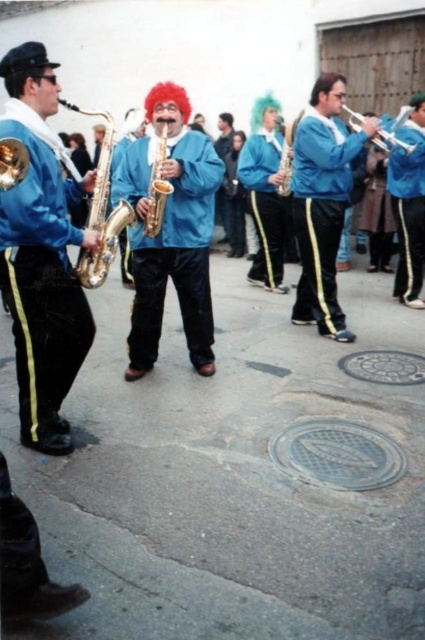
Based on the photo, does matte blue jacket at center have a lesser width compared to blue velvety jacket at center?

No.

Can you confirm if matte blue jacket at center is positioned below blue velvety jacket at center?

Yes.

Locate an element on the screen. The width and height of the screenshot is (425, 640). matte blue jacket at center is located at coordinates coord(172,246).

How much distance is there between velvet blue jacket at left and gold shiny trumpet at center?

velvet blue jacket at left is 32.61 inches away from gold shiny trumpet at center.

Is point (17, 138) farther from camera compared to point (159, 150)?

No, it is not.

Is point (19, 371) farther from camera compared to point (158, 209)?

No, it is in front of (158, 209).

You are a GUI agent. You are given a task and a screenshot of the screen. Output one action in this format:
    pyautogui.click(x=<x>, y=<y>)
    Task: Click on the velvet blue jacket at left
    The height and width of the screenshot is (640, 425).
    Given the screenshot: What is the action you would take?
    pyautogui.click(x=42, y=282)

Is gold shiny trumpet at center to the left of silver metallic trumpet at center from the viewer's perspective?

Correct, you'll find gold shiny trumpet at center to the left of silver metallic trumpet at center.

Is gold shiny trumpet at center closer to camera compared to silver metallic trumpet at center?

Yes.

Is point (152, 182) closer to camera compared to point (286, 188)?

Yes, point (152, 182) is closer to viewer.

Where is `gold shiny trumpet at center`? The height and width of the screenshot is (640, 425). gold shiny trumpet at center is located at coordinates (158, 184).